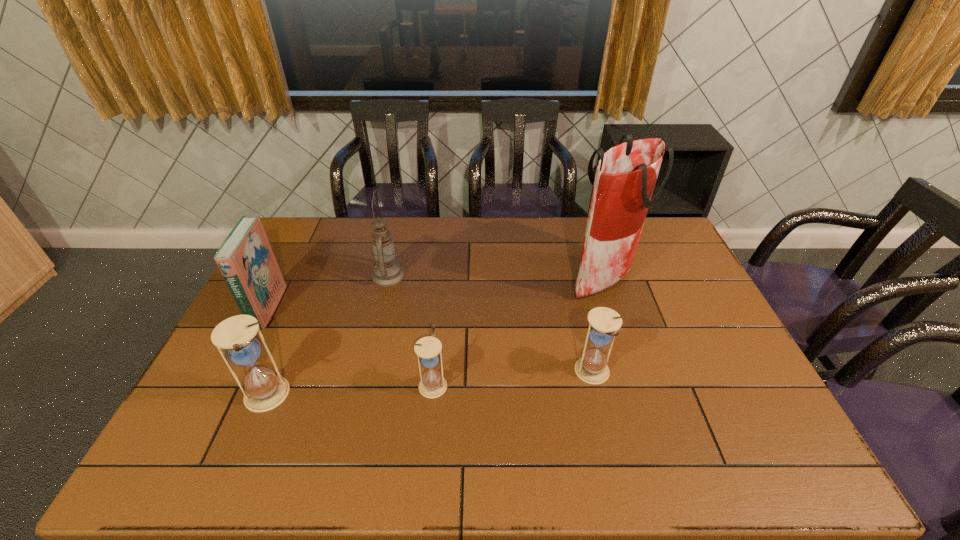
Identify the location of vacant region at the right edge of the desktop. The height and width of the screenshot is (540, 960). (693, 370).

Identify the location of vacant area at the far left corner. (283, 254).

The width and height of the screenshot is (960, 540). Identify the location of blank space at the near right corner of the desktop. (741, 413).

Where is `unoccupied area between the tallest object and the tallest hourglass`? Image resolution: width=960 pixels, height=540 pixels. unoccupied area between the tallest object and the tallest hourglass is located at coordinates (435, 337).

You are a GUI agent. You are given a task and a screenshot of the screen. Output one action in this format:
    pyautogui.click(x=<x>, y=<y>)
    Task: Click on the vacant area that lies between the leftmost object and the oil lamp
    The image size is (960, 540).
    Given the screenshot: What is the action you would take?
    pyautogui.click(x=328, y=292)

Where is `vacant space in between the second shortest object and the oil lamp`? vacant space in between the second shortest object and the oil lamp is located at coordinates (491, 324).

I want to click on free spot between the hardback book and the grocery bag, so [x=436, y=293].

In order to click on free space that is in between the fifth tallest object and the shortest hourglass in this screenshot , I will do `click(513, 378)`.

This screenshot has width=960, height=540. In order to click on unoccupied position between the grocery bag and the leftmost object in this screenshot , I will do `click(436, 293)`.

The image size is (960, 540). What are the coordinates of `free spot between the second hourglass from right to left and the third object from left to right` in the screenshot? It's located at (411, 330).